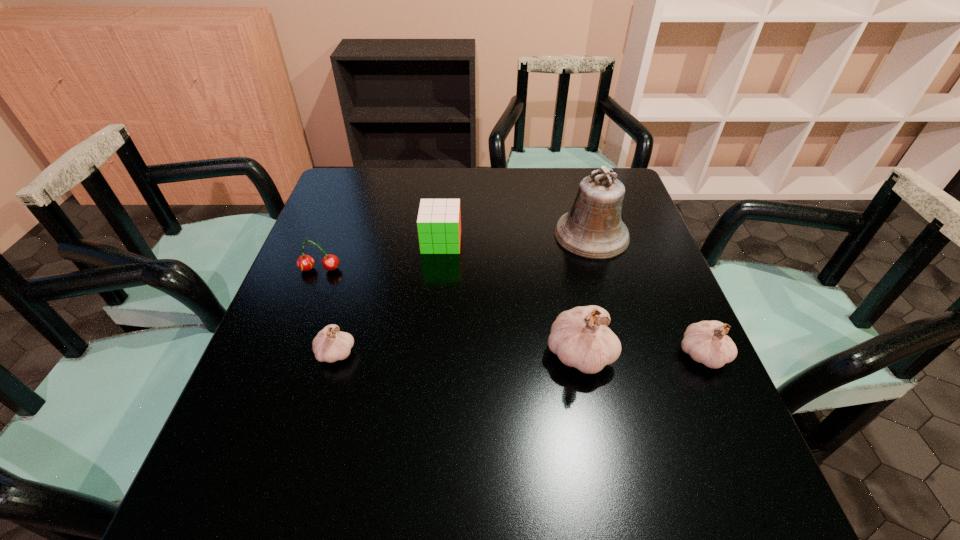
Locate an element on the screen. The image size is (960, 540). free space between the fourth shortest object and the bell is located at coordinates (647, 295).

The width and height of the screenshot is (960, 540). I want to click on free space that is in between the second object from left to right and the bell, so click(464, 293).

Identify the location of vacant space in between the shortest garlic and the fifth shortest object. The height and width of the screenshot is (540, 960). (458, 353).

Where is `object that is the fourth closest to the bell`? The width and height of the screenshot is (960, 540). object that is the fourth closest to the bell is located at coordinates (330, 345).

Locate which object is the fourth closest to the tallest garlic. Please provide its 2D coordinates. Your answer should be formatted as a tuple, i.e. [(x, y)], where the tuple contains the x and y coordinates of a point satisfying the conditions above.

[(330, 345)]

Locate which garlic is the closest to the rightmost object. Please provide its 2D coordinates. Your answer should be formatted as a tuple, i.e. [(x, y)], where the tuple contains the x and y coordinates of a point satisfying the conditions above.

[(580, 337)]

You are a GUI agent. You are given a task and a screenshot of the screen. Output one action in this format:
    pyautogui.click(x=<x>, y=<y>)
    Task: Click on the closest garlic to the second tallest object
    
    Given the screenshot: What is the action you would take?
    pyautogui.click(x=706, y=342)

Find the location of a particular element. Image resolution: width=960 pixels, height=540 pixels. vacant region that satisfies the following two spatial constraints: 1. on the front side of the shortest garlic; 2. on the right side of the second garlic from left to right is located at coordinates (336, 354).

Locate an element on the screen. The height and width of the screenshot is (540, 960). vacant space that satisfies the following two spatial constraints: 1. on the back side of the second tallest object; 2. on the left side of the bell is located at coordinates (556, 234).

This screenshot has width=960, height=540. I want to click on free location that satisfies the following two spatial constraints: 1. with stems pointing upwards on the rightmost garlic; 2. on the left side of the third farthest object, so click(x=287, y=355).